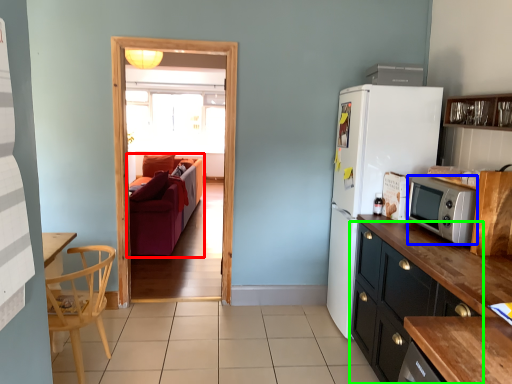
Question: Which object is positioned farthest from studio couch (highlighted by a red box)? Select from microwave oven (highlighted by a blue box) and cabinetry (highlighted by a green box).

Choices:
 (A) microwave oven
 (B) cabinetry

Answer: (A)